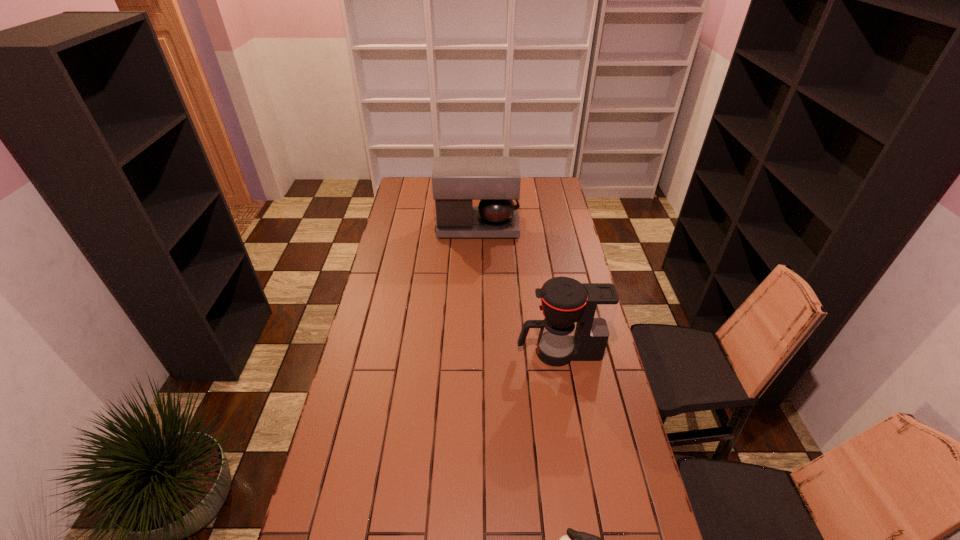
This screenshot has height=540, width=960. Identify the location of vacant area that lies between the farthest object and the nearer coffee maker. (518, 289).

The height and width of the screenshot is (540, 960). Identify the location of vacant point located between the nearer coffee maker and the farther coffee maker. (518, 289).

At what (x,y) coordinates should I click in order to perform the action: click on free space that is in between the second farthest object and the farther coffee maker. Please return your answer as a coordinate pair (x, y). The image size is (960, 540). Looking at the image, I should click on (518, 289).

What are the coordinates of `object that is the second nearest to the farther coffee maker` in the screenshot? It's located at (574, 539).

Locate an element on the screen. The height and width of the screenshot is (540, 960). object that is the second closest to the shortest object is located at coordinates (456, 181).